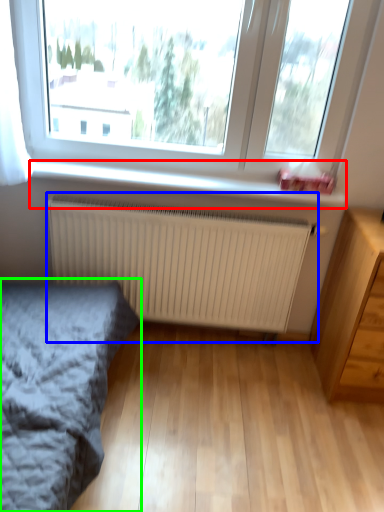
Question: Based on their relative distances, which object is nearer to window sill (highlighted by a red box)? Choose from radiator (highlighted by a blue box) and bed (highlighted by a green box).

Choices:
 (A) radiator
 (B) bed

Answer: (A)